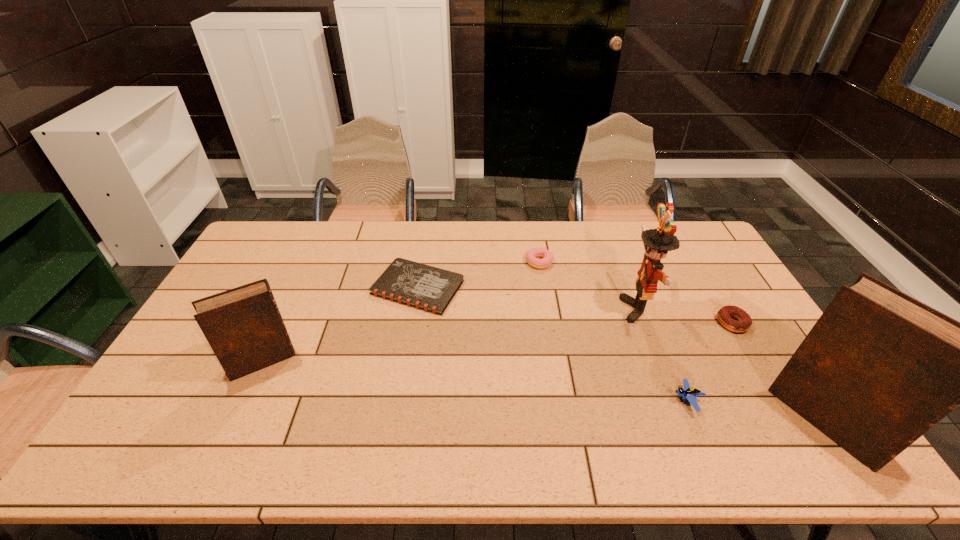
In the image, there is a desktop. Identify the location of vacant space at the left edge. point(241,270).

The width and height of the screenshot is (960, 540). In the image, there is a desktop. In order to click on vacant space at the right edge in this screenshot , I will do `click(705, 291)`.

Find the location of a particular element. This screenshot has width=960, height=540. vacant space at the near left corner is located at coordinates (153, 401).

Where is `vacant region at the far right corner of the desktop`? The height and width of the screenshot is (540, 960). vacant region at the far right corner of the desktop is located at coordinates (694, 226).

Where is `free space between the fifth object from right to left and the taller Bible`? The height and width of the screenshot is (540, 960). free space between the fifth object from right to left and the taller Bible is located at coordinates (683, 341).

This screenshot has width=960, height=540. Find the location of `unoccupied area between the nearer doughnut and the Lego`. unoccupied area between the nearer doughnut and the Lego is located at coordinates (709, 362).

Locate an element on the screen. This screenshot has height=540, width=960. free spot between the shorter Bible and the right Bible is located at coordinates click(544, 392).

Locate an element on the screen. This screenshot has width=960, height=540. free space between the right Bible and the nutcracker is located at coordinates (732, 366).

The image size is (960, 540). In order to click on free space between the nutcracker and the right Bible in this screenshot , I will do `click(732, 366)`.

Where is `unoccupied area between the Lego and the third object from left to right`? This screenshot has width=960, height=540. unoccupied area between the Lego and the third object from left to right is located at coordinates (613, 332).